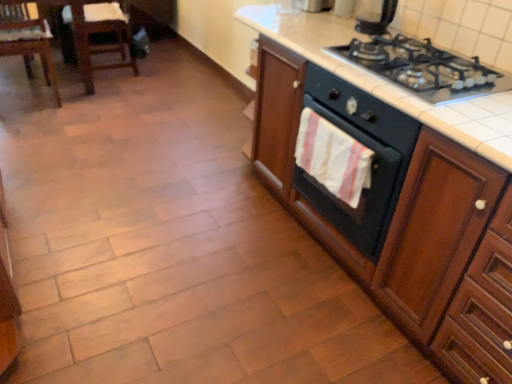
Question: From the image's perspective, is wooden cabinet at right located above black matte oven at center-right?

Choices:
 (A) yes
 (B) no

Answer: (A)

Question: Considering the relative positions of wooden cabinet at right and black matte oven at center-right in the image provided, is wooden cabinet at right to the left of black matte oven at center-right from the viewer's perspective?

Choices:
 (A) yes
 (B) no

Answer: (B)

Question: Is wooden cabinet at right positioned beyond the bounds of black matte oven at center-right?

Choices:
 (A) yes
 (B) no

Answer: (A)

Question: Does wooden cabinet at right have a greater width compared to black matte oven at center-right?

Choices:
 (A) no
 (B) yes

Answer: (B)

Question: Does wooden cabinet at right have a greater height compared to black matte oven at center-right?

Choices:
 (A) no
 (B) yes

Answer: (B)

Question: Is wooden cabinet at right positioned behind black matte oven at center-right?

Choices:
 (A) no
 (B) yes

Answer: (A)

Question: Could you tell me if black glass gas stove at upper right is facing black glossy kettle at upper right?

Choices:
 (A) no
 (B) yes

Answer: (A)

Question: From a real-world perspective, is black glass gas stove at upper right located higher than black glossy kettle at upper right?

Choices:
 (A) yes
 (B) no

Answer: (B)

Question: From the image's perspective, does black glass gas stove at upper right appear lower than black glossy kettle at upper right?

Choices:
 (A) no
 (B) yes

Answer: (B)

Question: Is black glass gas stove at upper right to the right of black glossy kettle at upper right from the viewer's perspective?

Choices:
 (A) yes
 (B) no

Answer: (A)

Question: Is black glass gas stove at upper right beside black glossy kettle at upper right?

Choices:
 (A) no
 (B) yes

Answer: (A)

Question: Is black glossy kettle at upper right a part of black glass gas stove at upper right?

Choices:
 (A) no
 (B) yes

Answer: (A)

Question: Does white cotton hand towel at center-right have a smaller size compared to black glass gas stove at upper right?

Choices:
 (A) yes
 (B) no

Answer: (A)